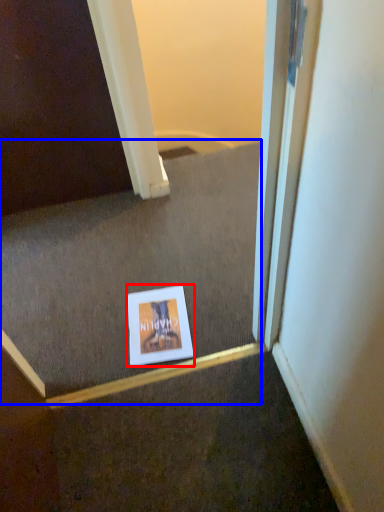
Question: Which object appears farthest to the camera in this image, picture frame (highlighted by a red box) or stairwell (highlighted by a blue box)?

Choices:
 (A) picture frame
 (B) stairwell

Answer: (A)